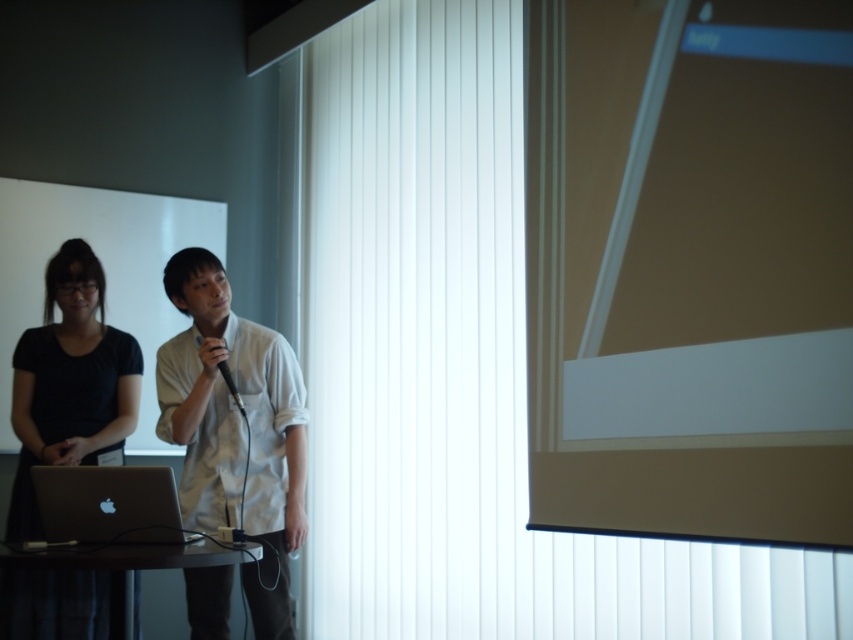
Which is in front, point (273, 420) or point (97, 536)?

Point (97, 536) is more forward.

Does white matte shirt at center have a greater width compared to silver metallic laptop at lower left?

Correct, the width of white matte shirt at center exceeds that of silver metallic laptop at lower left.

Is point (223, 326) positioned behind point (100, 504)?

Yes, point (223, 326) is behind point (100, 504).

Find the location of a particular element. The width and height of the screenshot is (853, 640). white matte shirt at center is located at coordinates (234, 428).

Between white vertical blinds at center and matte white projector screen at upper right, which one appears on the right side from the viewer's perspective?

matte white projector screen at upper right is more to the right.

Does white vertical blinds at center appear on the left side of matte white projector screen at upper right?

Indeed, white vertical blinds at center is positioned on the left side of matte white projector screen at upper right.

This screenshot has width=853, height=640. I want to click on white vertical blinds at center, so click(x=578, y=316).

You are a GUI agent. You are given a task and a screenshot of the screen. Output one action in this format:
    pyautogui.click(x=<x>, y=<y>)
    Task: Click on the white vertical blinds at center
    The image size is (853, 640).
    Given the screenshot: What is the action you would take?
    click(x=578, y=316)

Is dark wood table at lower left to the right of black matte microphone at center from the viewer's perspective?

Incorrect, dark wood table at lower left is not on the right side of black matte microphone at center.

Locate an element on the screen. dark wood table at lower left is located at coordinates (128, 564).

The height and width of the screenshot is (640, 853). In order to click on dark wood table at lower left in this screenshot , I will do `click(128, 564)`.

Where is `dark wood table at lower left`? dark wood table at lower left is located at coordinates (128, 564).